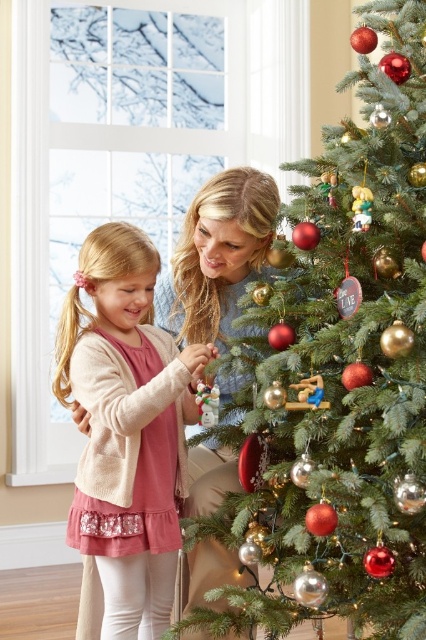
You are a decorator preparing to wrap gifts. You have a pink fabric dress at left and shiny metallic ornaments at center in front of you. Which item is bigger in size?

The shiny metallic ornaments at center are larger in size compared to the pink fabric dress at left.

Based on the scene description, can you determine which object is taller between the shiny metallic ornaments at center and the pink fabric dress at left?

The shiny metallic ornaments at center are taller than the pink fabric dress at left.